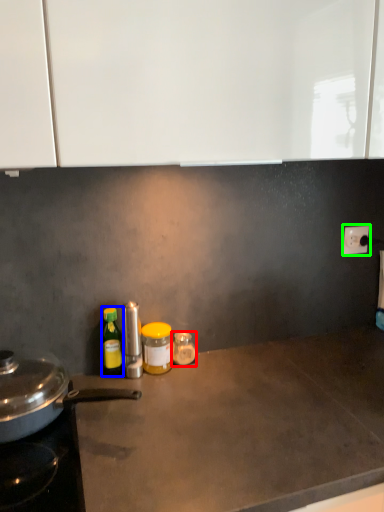
Question: Considering the real-world distances, which object is farthest from bottle (highlighted by a red box)? bottle (highlighted by a blue box) or electric outlet (highlighted by a green box)?

Choices:
 (A) bottle
 (B) electric outlet

Answer: (B)